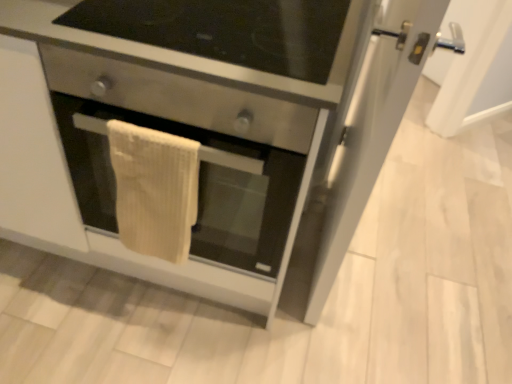
Question: Looking at the image, does stainless steel drawer at center seem bigger or smaller compared to stainless steel oven at center?

Choices:
 (A) small
 (B) big

Answer: (A)

Question: Is stainless steel drawer at center wider or thinner than stainless steel oven at center?

Choices:
 (A) wide
 (B) thin

Answer: (B)

Question: Based on their relative distances, which object is farther from the transparent glass door at right?

Choices:
 (A) stainless steel drawer at center
 (B) beige textured towel at center
 (C) stainless steel oven at center

Answer: (B)

Question: Which object is the closest to the stainless steel oven at center?

Choices:
 (A) transparent glass door at right
 (B) stainless steel drawer at center
 (C) beige textured towel at center

Answer: (C)